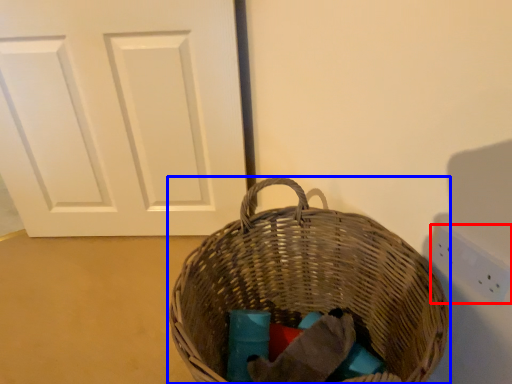
Question: Which object is closer to the camera taking this photo, electric outlet (highlighted by a red box) or picnic basket (highlighted by a blue box)?

Choices:
 (A) electric outlet
 (B) picnic basket

Answer: (B)